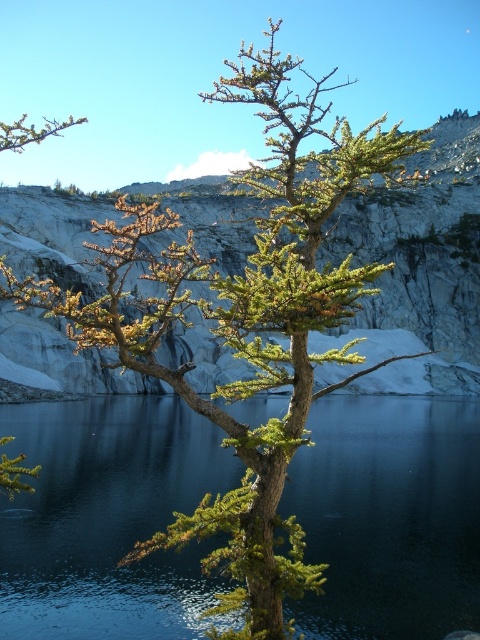
Question: Is green glossy water at center bigger than green textured rock at center?

Choices:
 (A) yes
 (B) no

Answer: (B)

Question: Which point is farther to the camera?

Choices:
 (A) green glossy water at center
 (B) green textured rock at center

Answer: (B)

Question: Observing the image, what is the correct spatial positioning of green glossy water at center in reference to green textured rock at center?

Choices:
 (A) above
 (B) below

Answer: (B)

Question: Can you confirm if green glossy water at center is wider than green textured rock at center?

Choices:
 (A) no
 (B) yes

Answer: (A)